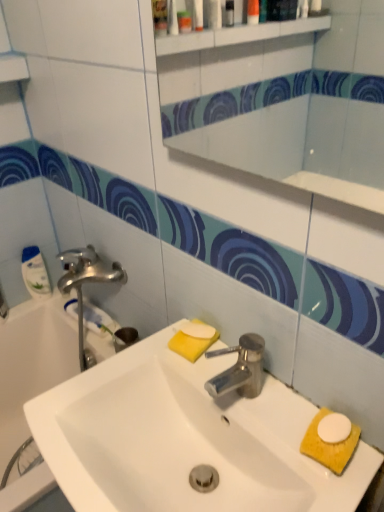
Question: Is white matte soap at center turned away from white glossy bathtub at left?

Choices:
 (A) yes
 (B) no

Answer: (B)

Question: Is white matte soap at center wider than white glossy bathtub at left?

Choices:
 (A) no
 (B) yes

Answer: (A)

Question: Could white glossy bathtub at left be considered to be inside white matte soap at center?

Choices:
 (A) yes
 (B) no

Answer: (B)

Question: From a real-world perspective, is white matte soap at center below white glossy bathtub at left?

Choices:
 (A) yes
 (B) no

Answer: (B)

Question: Could you tell me if white matte soap at center is turned towards white glossy bathtub at left?

Choices:
 (A) no
 (B) yes

Answer: (A)

Question: From the image's perspective, is white matte soap at center on top of white glossy bathtub at left?

Choices:
 (A) yes
 (B) no

Answer: (A)

Question: Could you tell me if yellow sponge at lower right is turned towards white glossy mirror at upper center?

Choices:
 (A) no
 (B) yes

Answer: (A)

Question: From the image's perspective, is yellow sponge at lower right under white glossy mirror at upper center?

Choices:
 (A) no
 (B) yes

Answer: (B)

Question: Is yellow sponge at lower right turned away from white glossy mirror at upper center?

Choices:
 (A) yes
 (B) no

Answer: (B)

Question: Is yellow sponge at lower right positioned before white glossy mirror at upper center?

Choices:
 (A) yes
 (B) no

Answer: (B)

Question: Does yellow sponge at lower right have a greater width compared to white glossy mirror at upper center?

Choices:
 (A) no
 (B) yes

Answer: (B)

Question: Is yellow sponge at lower right taller than white glossy mirror at upper center?

Choices:
 (A) yes
 (B) no

Answer: (B)

Question: From the image's perspective, does white glossy sink at center appear lower than white glossy mirror at upper center?

Choices:
 (A) yes
 (B) no

Answer: (A)